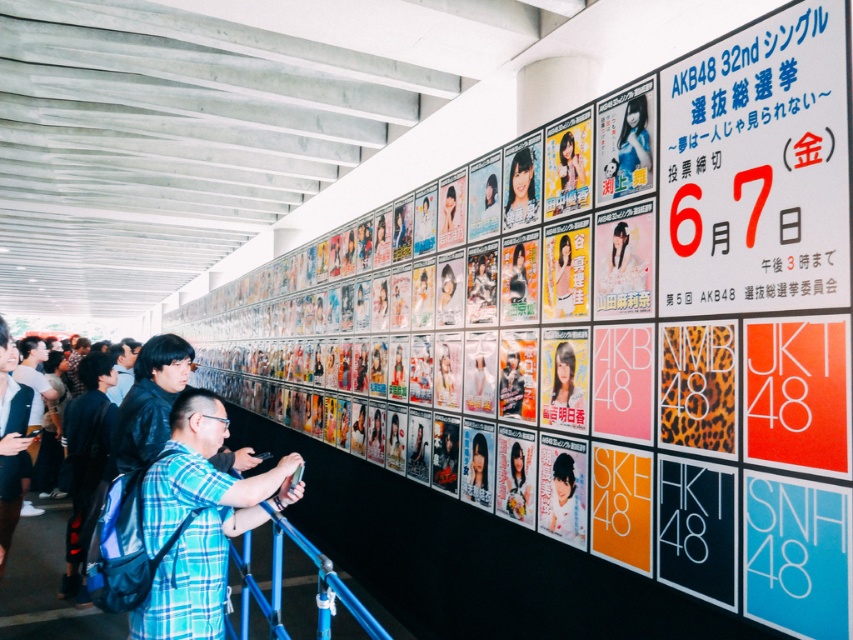
Question: Does blue plaid shirt at center have a greater width compared to matte white poster at center?

Choices:
 (A) no
 (B) yes

Answer: (B)

Question: Which of the following is the closest to the observer?

Choices:
 (A) (534, 186)
 (B) (558, 349)

Answer: (B)

Question: Based on their relative distances, which object is nearer to the matte black jacket at center?

Choices:
 (A) matte plastic poster at center
 (B) matte white poster at center
 (C) matte pink poster at center

Answer: (B)

Question: Can you confirm if shiny blonde hair at center is positioned to the left of matte black jacket at center?

Choices:
 (A) yes
 (B) no

Answer: (B)

Question: Can you confirm if matte white poster at center is bigger than dark blue shirt at center?

Choices:
 (A) yes
 (B) no

Answer: (B)

Question: Which object appears farthest from the camera in this image?

Choices:
 (A) blue plaid shirt at center
 (B) matte pink poster at center

Answer: (B)